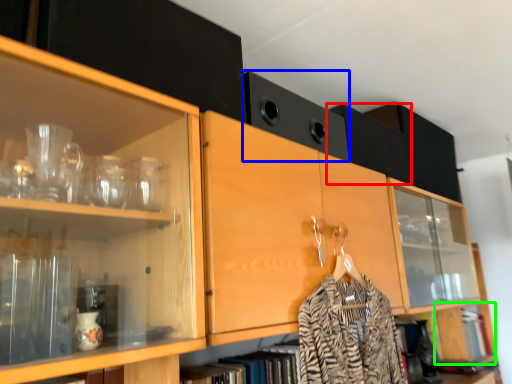
Question: Considering the real-world distances, which object is closest to cabinetry (highlighted by a red box)? cabinetry (highlighted by a blue box) or cabinetry (highlighted by a green box).

Choices:
 (A) cabinetry
 (B) cabinetry

Answer: (A)